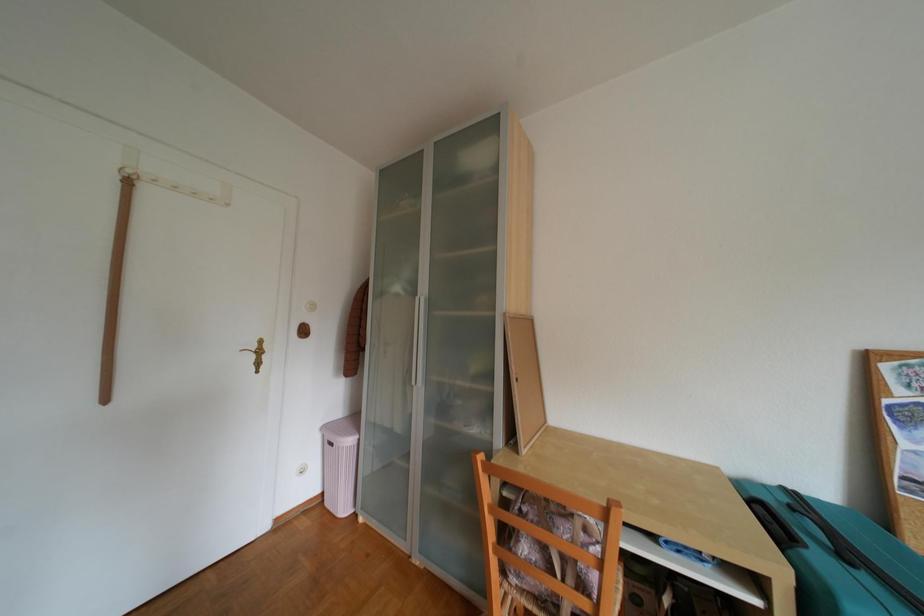
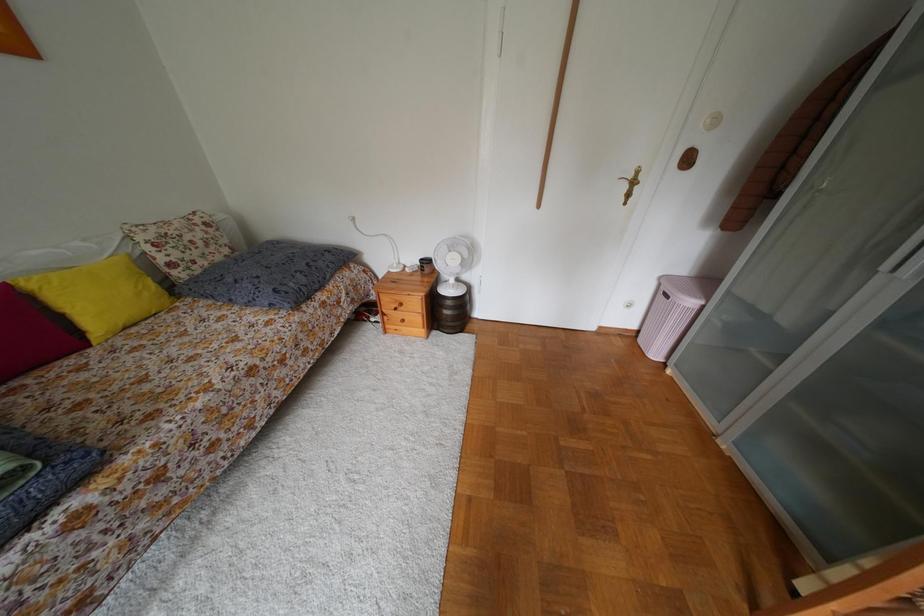
The images are taken continuously from a first-person perspective. In which direction is your viewpoint rotating?

The camera's rotation is toward left-down.